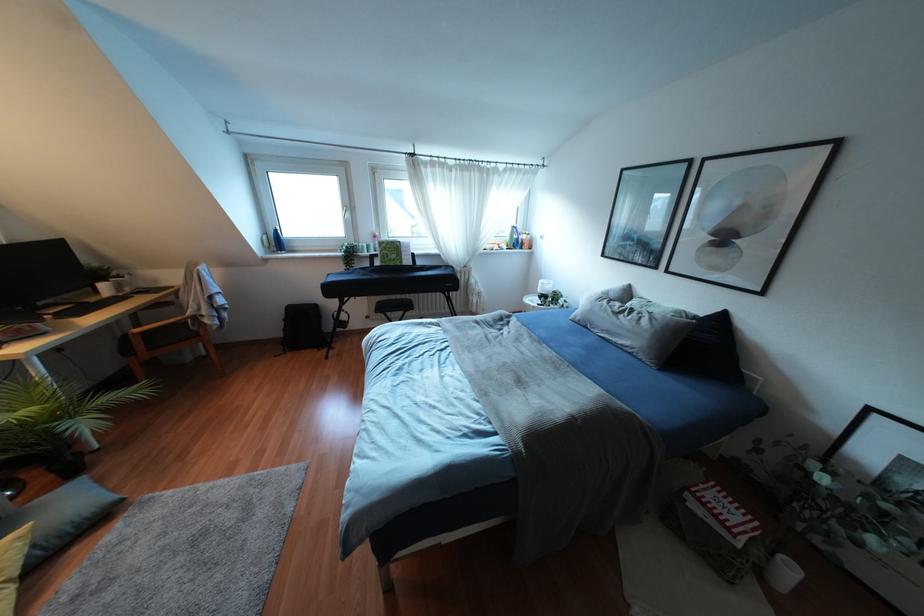
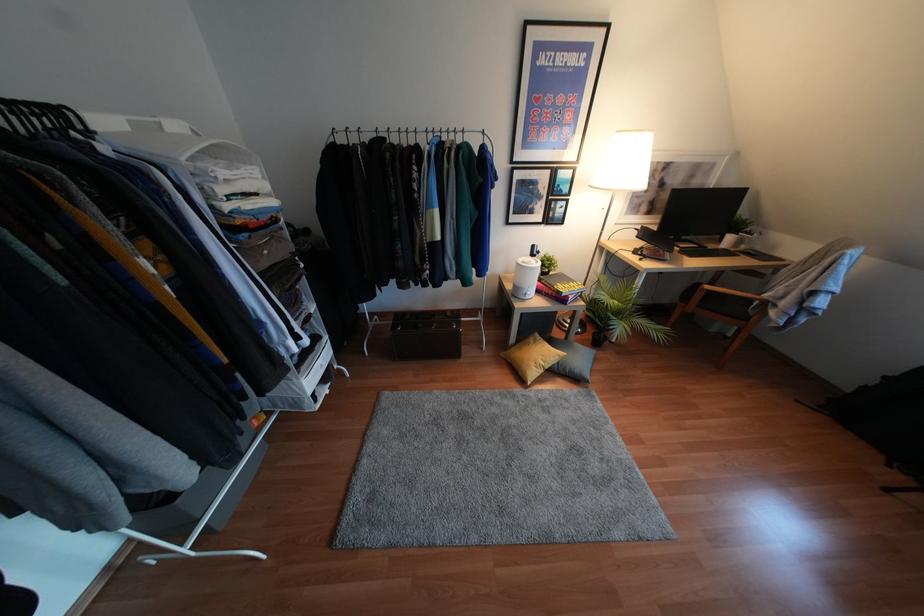
Find the pixel in the second image that matches point 32,546 in the first image.

(556, 362)